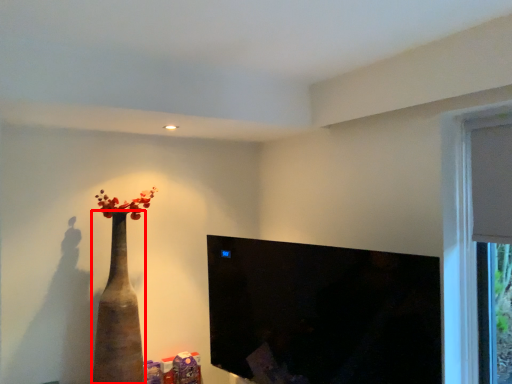
Question: From the image's perspective, what is the correct spatial relationship of vase (annotated by the red box) in relation to window screen?

Choices:
 (A) below
 (B) above

Answer: (B)